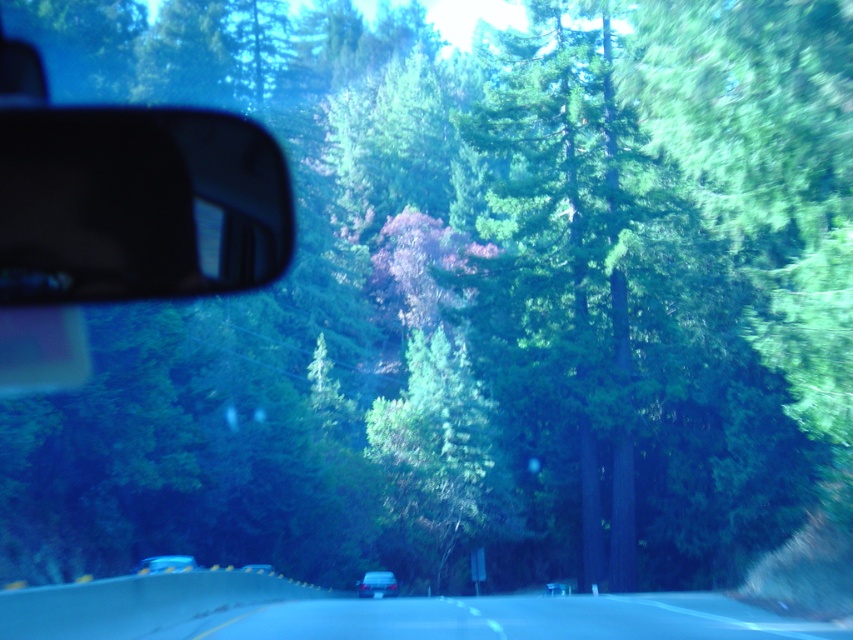
Consider the image. Is green leafy tree at center bigger than metallic silver sedan at center?

Yes.

Is the position of green leafy tree at center more distant than that of metallic silver sedan at center?

Yes, it is behind metallic silver sedan at center.

Image resolution: width=853 pixels, height=640 pixels. I want to click on green leafy tree at center, so click(x=437, y=449).

Who is positioned more to the left, smooth asphalt road at center or metallic silver sedan at center?

metallic silver sedan at center

Is point (42, 609) positioned behind point (257, 568)?

No, it is in front of (257, 568).

The width and height of the screenshot is (853, 640). I want to click on smooth asphalt road at center, so click(373, 612).

Does point (527, 634) come closer to viewer compared to point (387, 584)?

That is True.

Who is taller, smooth asphalt road at center or matte black car at center?

With more height is smooth asphalt road at center.

Is point (611, 625) positioned behind point (379, 573)?

No, it is in front of (379, 573).

This screenshot has width=853, height=640. Identify the location of smooth asphalt road at center. (373, 612).